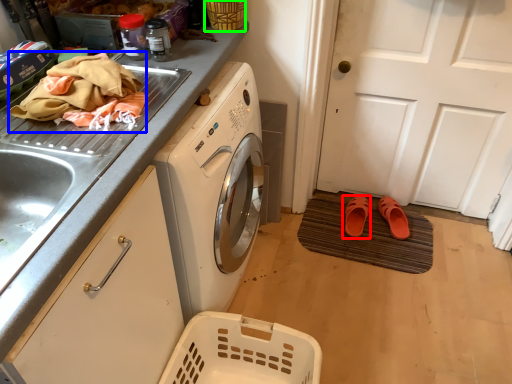
Question: Which is farther away from footwear (highlighted by a red box)? material (highlighted by a blue box) or basket (highlighted by a green box)?

Choices:
 (A) material
 (B) basket

Answer: (A)